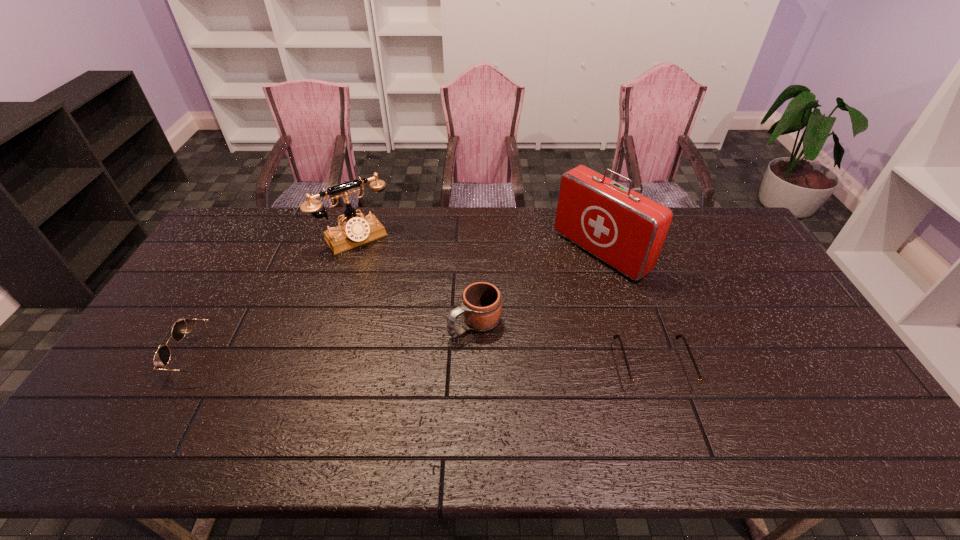
Where is `vacant area that lies between the tallest object and the sunglasses`? This screenshot has height=540, width=960. vacant area that lies between the tallest object and the sunglasses is located at coordinates (403, 303).

This screenshot has height=540, width=960. Identify the location of vacant space in between the tallest object and the telephone. (477, 245).

I want to click on empty location between the spectacles and the leftmost object, so click(430, 361).

Locate an element on the screen. The image size is (960, 540). blank region between the second shortest object and the fourth object from right to left is located at coordinates (280, 296).

The height and width of the screenshot is (540, 960). Identify the location of vacant point located between the sunglasses and the shortest object. (430, 361).

Identify the location of empty space that is in between the spectacles and the second object from left to right. (504, 302).

In order to click on empty space that is in between the sunglasses and the first-aid kit in this screenshot , I will do `click(403, 303)`.

You are a GUI agent. You are given a task and a screenshot of the screen. Output one action in this format:
    pyautogui.click(x=<x>, y=<y>)
    Task: Click on the free area in between the third object from right to left and the telephone
    
    Given the screenshot: What is the action you would take?
    pyautogui.click(x=415, y=280)

Where is `the fourth closest object to the mug`? The image size is (960, 540). the fourth closest object to the mug is located at coordinates (161, 359).

At what (x,y) coordinates should I click in order to perform the action: click on object that stands as the second closest to the third object from left to right. Please return your answer as a coordinate pair (x, y). Looking at the image, I should click on (642, 386).